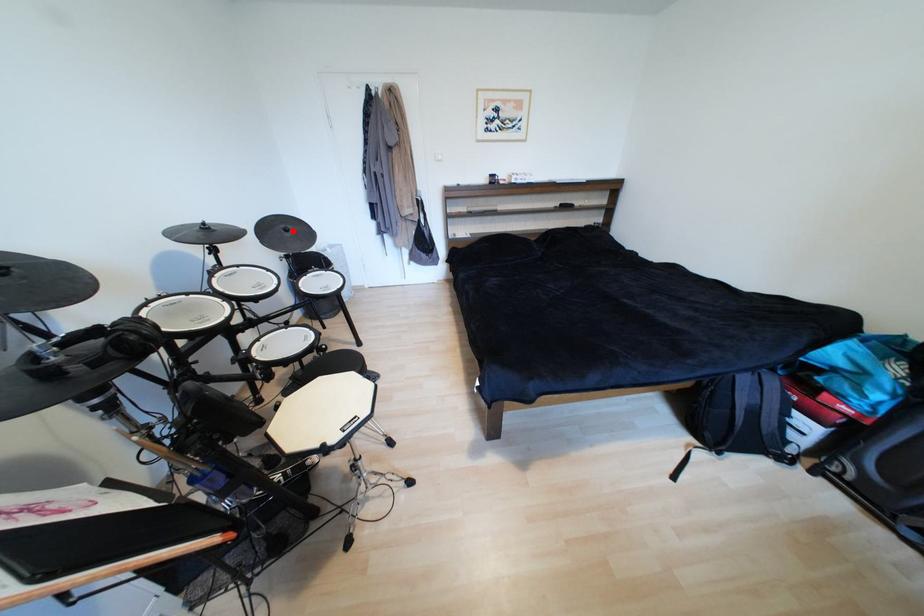
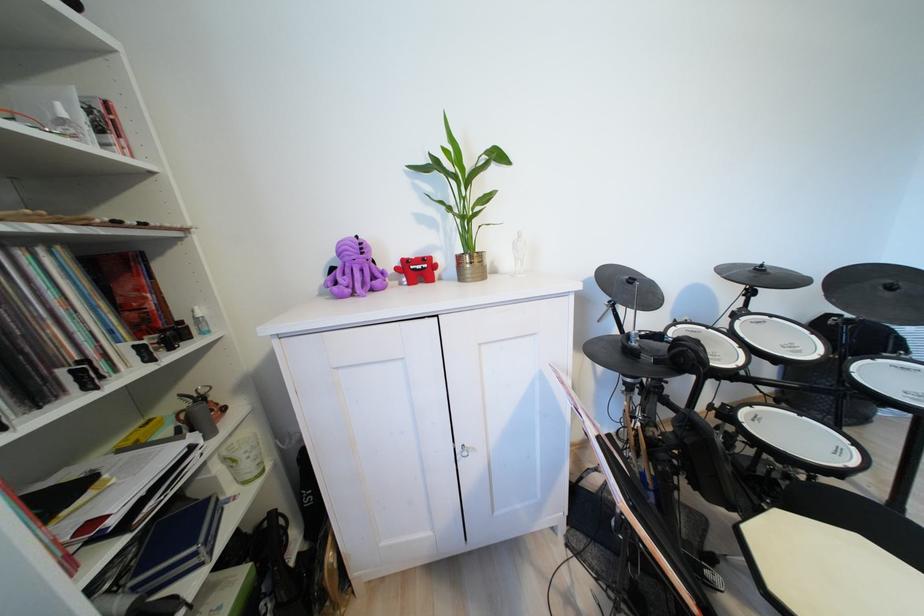
The point at the highlighted location is marked in the first image. Where is the corresponding point in the second image?

(897, 289)